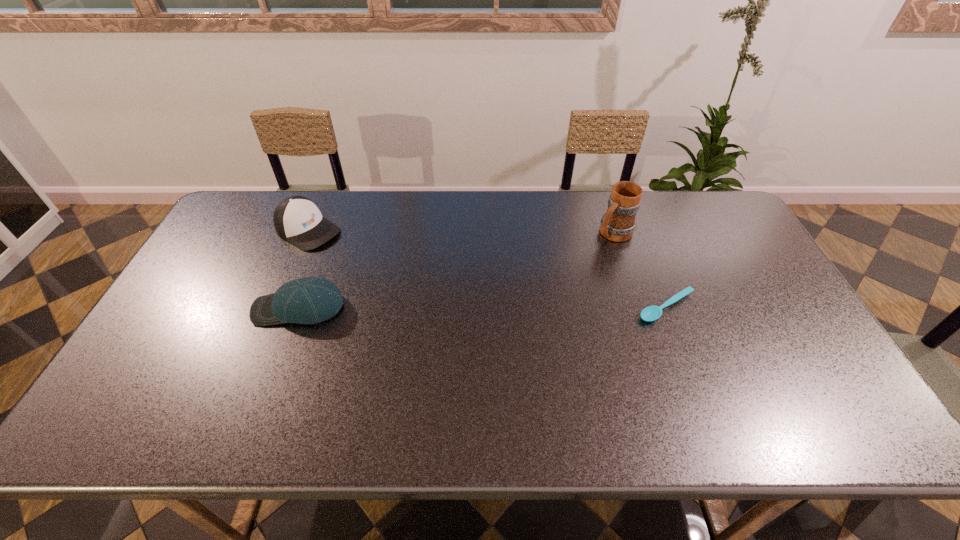
You are a GUI agent. You are given a task and a screenshot of the screen. Output one action in this format:
    pyautogui.click(x=<x>, y=<y>)
    Task: Click on the free spot located 0.380m on the front panel of the cap
    This screenshot has width=960, height=540.
    Given the screenshot: What is the action you would take?
    pyautogui.click(x=419, y=296)

The image size is (960, 540). Identify the location of blank space located 0.260m on the front panel of the cap. (388, 278).

Image resolution: width=960 pixels, height=540 pixels. Find the location of `mug that is at the far edge`. mug that is at the far edge is located at coordinates (618, 224).

Locate an element on the screen. The image size is (960, 540). cap at the far edge is located at coordinates (297, 219).

This screenshot has height=540, width=960. In the image, there is a desktop. What are the coordinates of `vacant area at the far edge` in the screenshot? It's located at (399, 210).

Find the location of a particular element. vacant space at the near edge of the desktop is located at coordinates (x=371, y=394).

Identify the location of free space at the left edge of the desktop. This screenshot has width=960, height=540. (220, 299).

This screenshot has height=540, width=960. In the image, there is a desktop. Find the location of `free space at the right edge`. free space at the right edge is located at coordinates pos(804,354).

This screenshot has height=540, width=960. I want to click on vacant space at the far right corner, so click(x=703, y=205).

Locate an element on the screen. Image resolution: width=960 pixels, height=540 pixels. free space between the cap and the baseball cap is located at coordinates (303, 269).